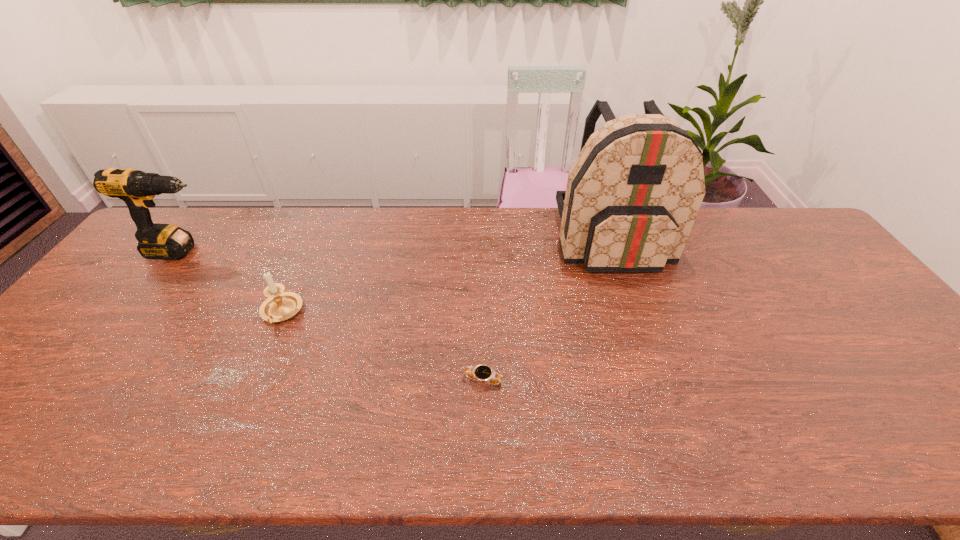
You are a GUI agent. You are given a task and a screenshot of the screen. Output one action in this format:
    pyautogui.click(x=<x>, y=<y>)
    Task: Click on the vacant space in between the backpack and the shortest object
    The width and height of the screenshot is (960, 540).
    Given the screenshot: What is the action you would take?
    pyautogui.click(x=548, y=310)

Find the location of a particular element. This screenshot has height=540, width=960. vacant area that lies between the second nearest object and the drill is located at coordinates tap(231, 282).

The image size is (960, 540). Identify the location of vacant point located between the third tallest object and the rightmost object. (446, 276).

I want to click on unoccupied position between the second nearest object and the drill, so (x=231, y=282).

Where is `free spot between the nearest object and the tallest object`? The width and height of the screenshot is (960, 540). free spot between the nearest object and the tallest object is located at coordinates (548, 310).

At what (x,y) coordinates should I click in order to perform the action: click on free area in between the drill and the third object from right to left. Please return your answer as a coordinate pair (x, y). The width and height of the screenshot is (960, 540). Looking at the image, I should click on (231, 282).

The height and width of the screenshot is (540, 960). Identify the location of unoccupied area between the backpack and the leftmost object. (397, 246).

Identify the location of free space between the third shortest object and the tallest object. (397, 246).

In order to click on vacant region between the nearest object and the tallest object in this screenshot , I will do `click(548, 310)`.

Find the location of `object identified as the second closest to the third object from left to right`. object identified as the second closest to the third object from left to right is located at coordinates (279, 306).